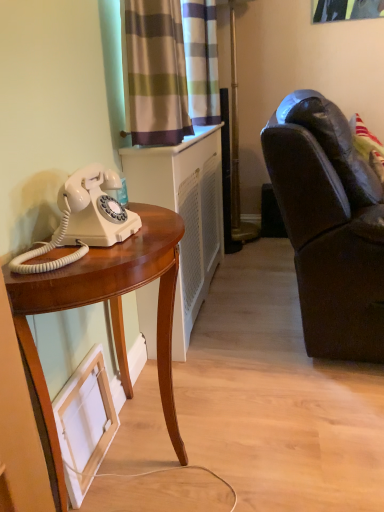
At what (x,y) coordinates should I click in order to perform the action: click on free space above mahogany wood desk at left (from a real-world perspective). Please return your answer as a coordinate pair (x, y). This screenshot has height=512, width=384. Looking at the image, I should click on (115, 245).